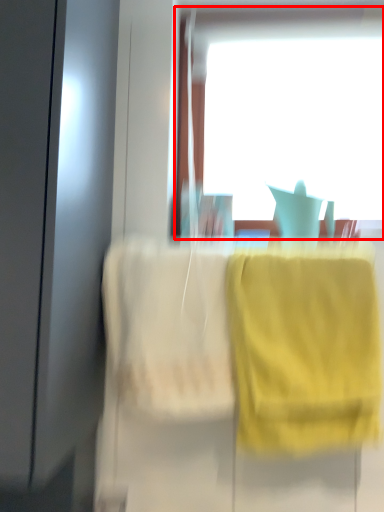
Question: From the image's perspective, considering the relative positions of window (annotated by the red box) and towel/napkin in the image provided, where is window (annotated by the red box) located with respect to the staircase?

Choices:
 (A) below
 (B) above

Answer: (B)